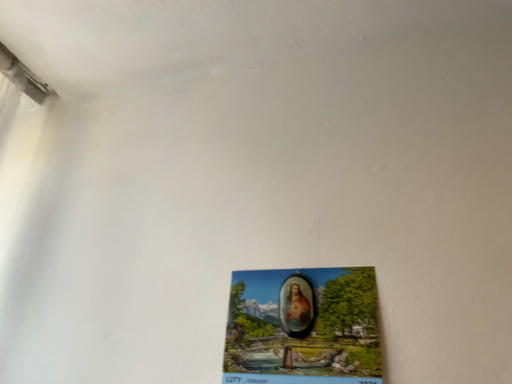
Identify the location of metallic glossy picture frame at center. (303, 327).

Describe the element at coordinates (303, 327) in the screenshot. This screenshot has height=384, width=512. I see `metallic glossy picture frame at center` at that location.

At what (x,y) coordinates should I click in order to perform the action: click on metallic glossy picture frame at center. Please return your answer as a coordinate pair (x, y). This screenshot has height=384, width=512. Looking at the image, I should click on (303, 327).